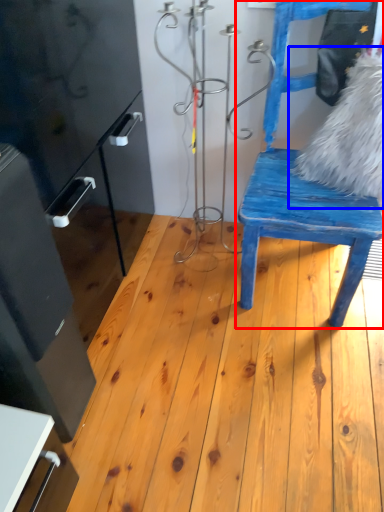
Question: Which of the following is the farthest to the observer, chair (highlighted by a red box) or animal (highlighted by a blue box)?

Choices:
 (A) chair
 (B) animal

Answer: (B)